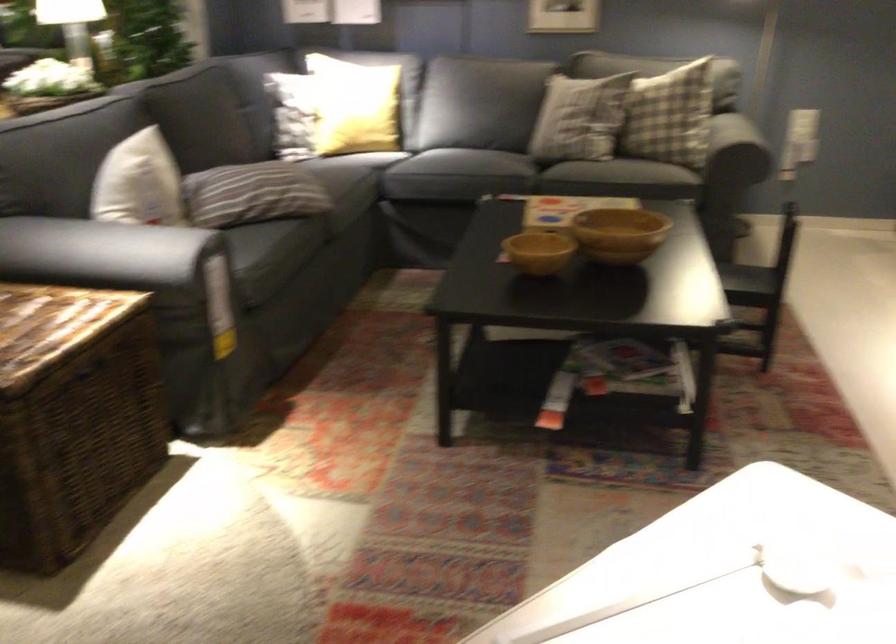
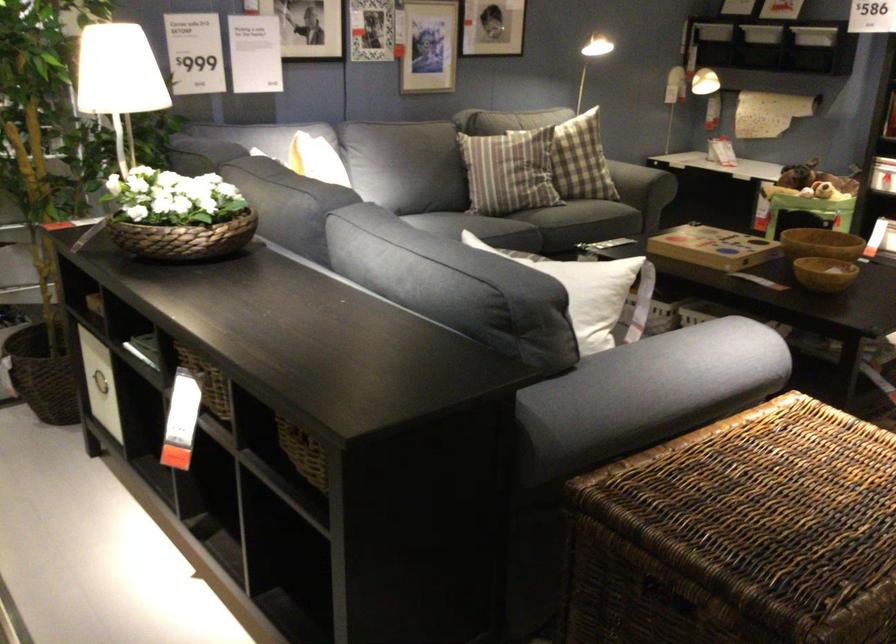
In the second image, find the point that corresponds to (574,223) in the first image.

(821, 243)